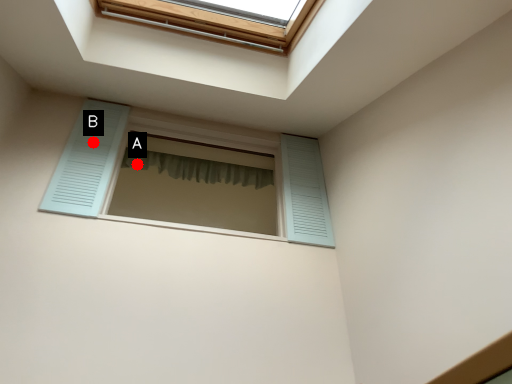
Question: Two points are circled on the image, labeled by A and B beside each circle. Which point appears closest to the camera in this image?

Choices:
 (A) A is closer
 (B) B is closer

Answer: (B)